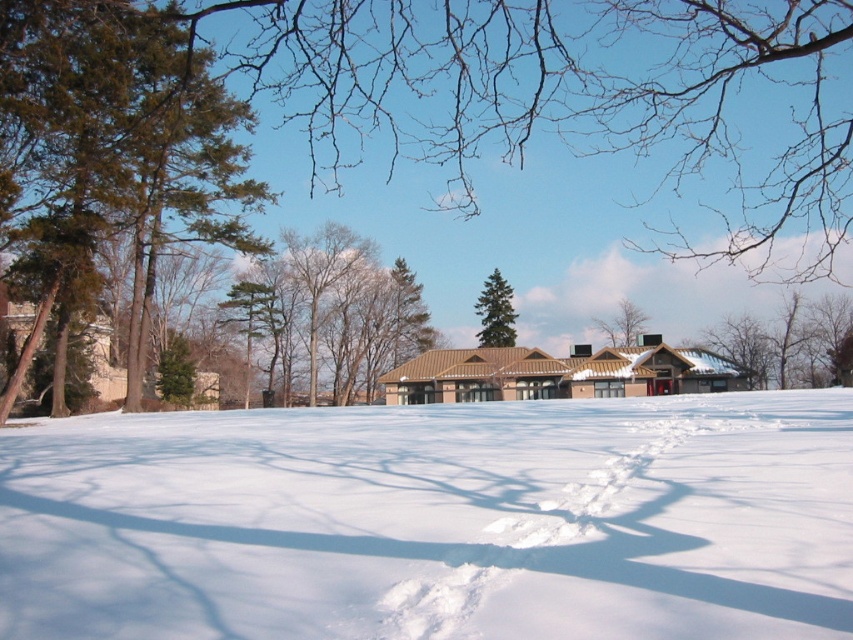
Can you confirm if brown textured tree at center is thinner than green matte tree at center?

Incorrect, brown textured tree at center's width is not less than green matte tree at center's.

Is brown textured tree at center smaller than green matte tree at center?

Actually, brown textured tree at center might be larger than green matte tree at center.

I want to click on brown textured tree at center, so click(x=335, y=310).

Measure the distance between white fluffy snow at center and brown textured tree at center.

151.57 feet

Between white fluffy snow at center and brown textured tree at center, which one is positioned lower?

white fluffy snow at center is lower down.

Does point (16, 621) come closer to viewer compared to point (352, 276)?

Yes, point (16, 621) is closer to viewer.

What are the coordinates of `white fluffy snow at center` in the screenshot? It's located at (434, 520).

From the picture: Which of these two, green evergreen tree at left or brown textured tree at center, stands taller?

green evergreen tree at left

Is green evergreen tree at left closer to the viewer compared to brown textured tree at center?

That is True.

Is point (141, 45) farther from camera compared to point (334, 401)?

No, it is in front of (334, 401).

Where is `green evergreen tree at left`? This screenshot has width=853, height=640. green evergreen tree at left is located at coordinates (111, 150).